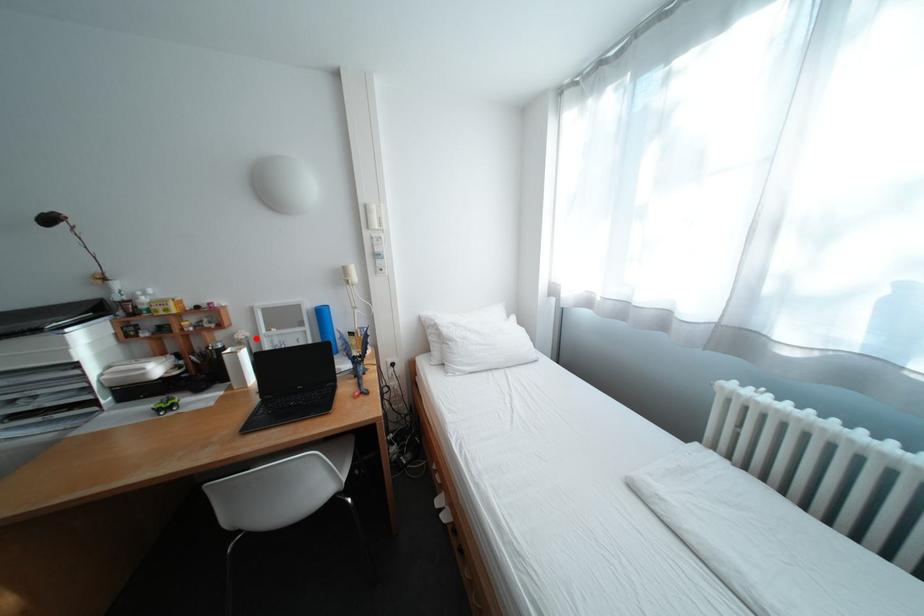
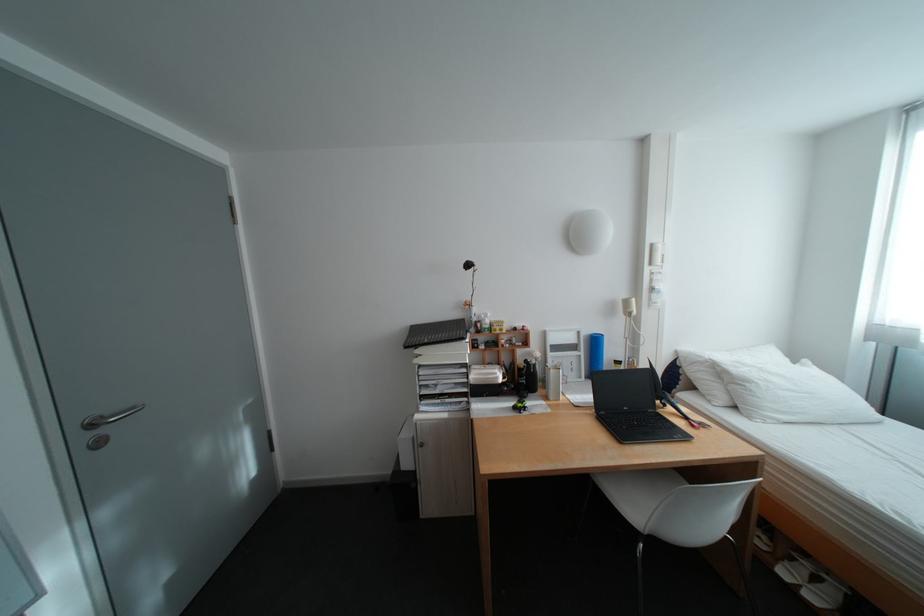
Question: I am providing you with two images of the same scene from different viewpoints. In image1, a red point is highlighted. Considering the same 3D point in image2, which of the following is correct?

Choices:
 (A) It is closer
 (B) It is farther

Answer: (B)